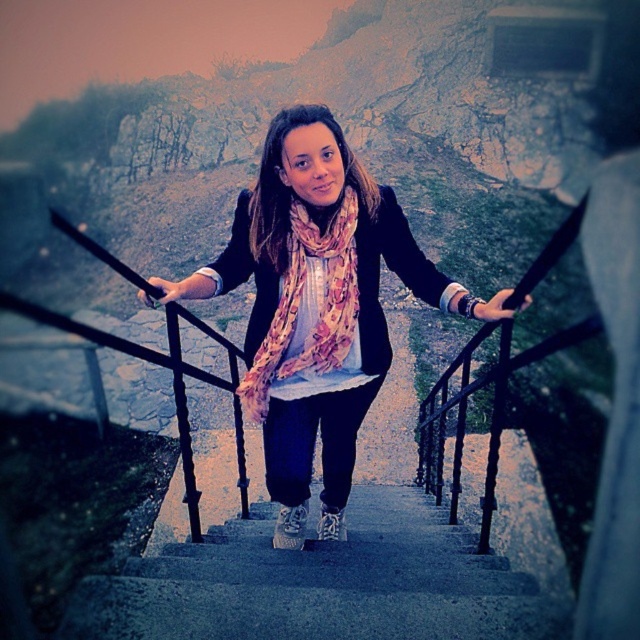
You are standing at the top of the stone staircase and want to place a small decoration between the two points labeled point [320,369] and point [305,346]. Which point is closer to you so you can place the decoration there?

Point [320,369] is further to the viewer than point [305,346], so the closer point to you is point [305,346]. Place the decoration near point [305,346].

Where is the pink floral scarf at center located in the image?

The pink floral scarf at center is located at point (x=316, y=307).

You are an interior designer planning to place a decorative item on the concrete stairs at center. The floral silk scarf at center is currently placed there. Can the stairs accommodate a larger item than the scarf?

Answer: The concrete stairs at center is smaller than the floral silk scarf at center, so it cannot accommodate a larger item than the scarf.